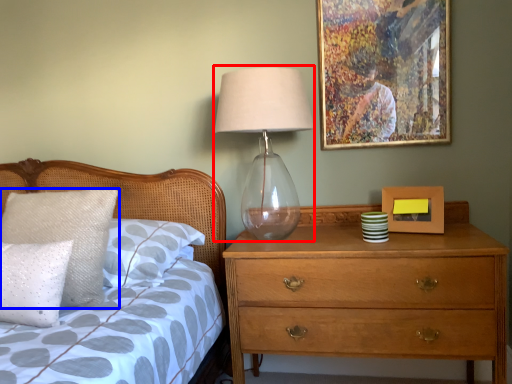
Question: Which point is closer to the camera, table lamp (highlighted by a red box) or pillow (highlighted by a blue box)?

Choices:
 (A) table lamp
 (B) pillow

Answer: (B)